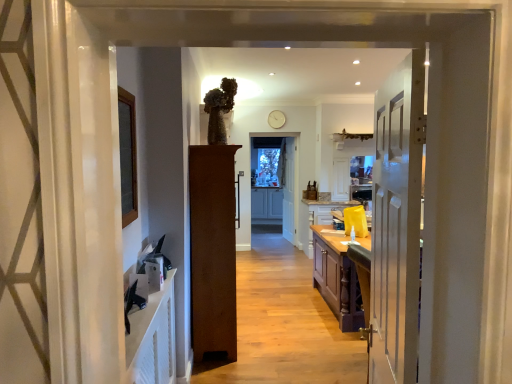
Locate an element on the screen. vacant area that lies to the right of brown wood cabinet at center, the second door when ordered from front to back is located at coordinates (275, 328).